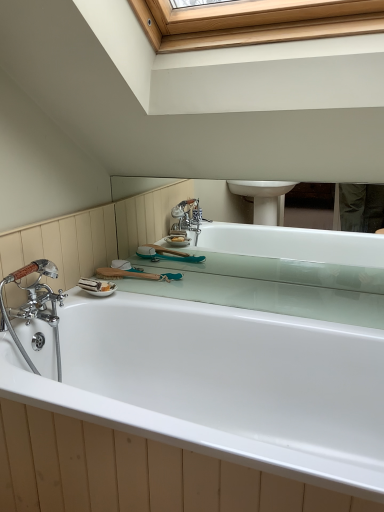
Question: Considering the relative sizes of white glossy bathtub at center and wooden handled brush at upper center in the image provided, is white glossy bathtub at center smaller than wooden handled brush at upper center?

Choices:
 (A) no
 (B) yes

Answer: (A)

Question: Is white glossy bathtub at center oriented away from wooden handled brush at upper center?

Choices:
 (A) no
 (B) yes

Answer: (B)

Question: Does white glossy bathtub at center turn towards wooden handled brush at upper center?

Choices:
 (A) yes
 (B) no

Answer: (B)

Question: Is white glossy bathtub at center in contact with wooden handled brush at upper center?

Choices:
 (A) no
 (B) yes

Answer: (A)

Question: From the image's perspective, is white glossy bathtub at center below wooden handled brush at upper center?

Choices:
 (A) no
 (B) yes

Answer: (B)

Question: From a real-world perspective, is white glossy bathtub at center on wooden handled brush at upper center?

Choices:
 (A) yes
 (B) no

Answer: (B)

Question: Is wooden handled brush at upper center completely or partially outside of white glossy bathtub at center?

Choices:
 (A) yes
 (B) no

Answer: (A)

Question: From a real-world perspective, is wooden handled brush at upper center over white glossy bathtub at center?

Choices:
 (A) no
 (B) yes

Answer: (B)

Question: Does wooden handled brush at upper center have a larger size compared to white glossy bathtub at center?

Choices:
 (A) no
 (B) yes

Answer: (A)

Question: Does wooden handled brush at upper center appear on the left side of white glossy bathtub at center?

Choices:
 (A) no
 (B) yes

Answer: (B)

Question: Considering the relative sizes of wooden handled brush at upper center and white glossy bathtub at center in the image provided, is wooden handled brush at upper center thinner than white glossy bathtub at center?

Choices:
 (A) no
 (B) yes

Answer: (B)

Question: Is wooden handled brush at upper center oriented towards white glossy bathtub at center?

Choices:
 (A) no
 (B) yes

Answer: (A)

Question: From a real-world perspective, is wooden handled brush at upper center above or below white glossy bathtub at center?

Choices:
 (A) above
 (B) below

Answer: (A)